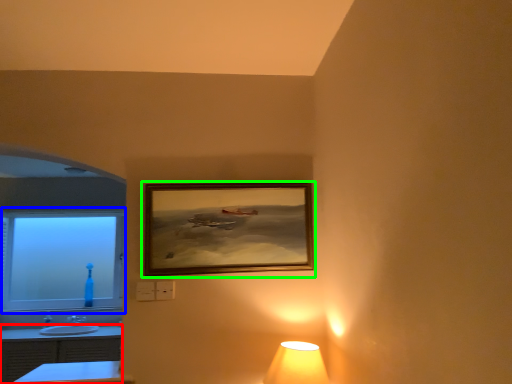
Question: Considering the real-world distances, which object is farthest from dresser (highlighted by a red box)? window (highlighted by a blue box) or picture frame (highlighted by a green box)?

Choices:
 (A) window
 (B) picture frame

Answer: (B)